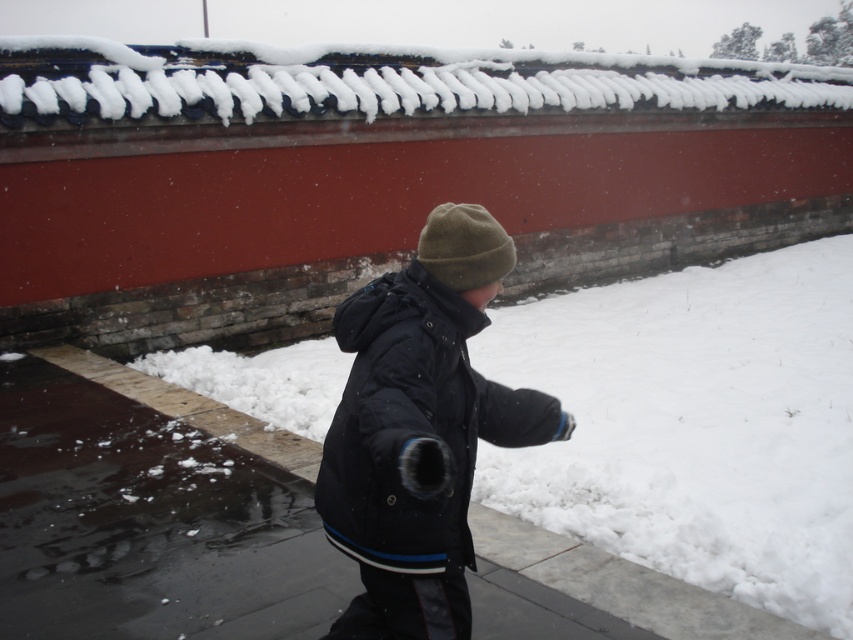
Measure the distance from black matte jacket at center to green woolen beanie at center.

black matte jacket at center is 54.48 centimeters from green woolen beanie at center.

Can you confirm if black matte jacket at center is thinner than green woolen beanie at center?

Incorrect, black matte jacket at center's width is not less than green woolen beanie at center's.

Where is `black matte jacket at center`? This screenshot has width=853, height=640. black matte jacket at center is located at coordinates (421, 429).

Which is above, white fluffy snow at center or green woolen beanie at center?

green woolen beanie at center is above.

Which of these two, white fluffy snow at center or green woolen beanie at center, stands taller?

With more height is white fluffy snow at center.

Between point (842, 634) and point (430, 275), which one is positioned behind?

The point (842, 634) is behind.

Where is `white fluffy snow at center`? The width and height of the screenshot is (853, 640). white fluffy snow at center is located at coordinates (695, 424).

Which is in front, point (653, 280) or point (343, 452)?

Point (343, 452) is more forward.

This screenshot has width=853, height=640. I want to click on white fluffy snow at center, so click(695, 424).

Is point (844, 352) positioned before point (460, 211)?

No, (844, 352) is behind (460, 211).

Identify the location of white fluffy snow at center. (695, 424).